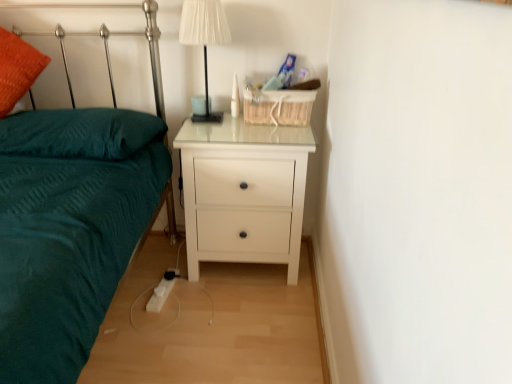
Question: Should I look upward or downward to see white glossy nightstand at center?

Choices:
 (A) up
 (B) down

Answer: (B)

Question: Considering the relative sizes of white fabric lampshade at upper center and teal soft pillow at left in the image provided, is white fabric lampshade at upper center bigger than teal soft pillow at left?

Choices:
 (A) yes
 (B) no

Answer: (B)

Question: Is the depth of white fabric lampshade at upper center greater than that of teal soft pillow at left?

Choices:
 (A) no
 (B) yes

Answer: (B)

Question: Does white fabric lampshade at upper center have a lesser width compared to teal soft pillow at left?

Choices:
 (A) yes
 (B) no

Answer: (A)

Question: Is white fabric lampshade at upper center not within teal soft pillow at left?

Choices:
 (A) yes
 (B) no

Answer: (A)

Question: Considering the relative sizes of white fabric lampshade at upper center and teal soft pillow at left in the image provided, is white fabric lampshade at upper center taller than teal soft pillow at left?

Choices:
 (A) no
 (B) yes

Answer: (B)

Question: Considering the relative positions of white fabric lampshade at upper center and teal soft pillow at left in the image provided, is white fabric lampshade at upper center to the left of teal soft pillow at left from the viewer's perspective?

Choices:
 (A) yes
 (B) no

Answer: (B)

Question: Is white glossy nightstand at center shorter than teal soft pillow at left?

Choices:
 (A) yes
 (B) no

Answer: (B)

Question: Could you tell me if white glossy nightstand at center is facing teal soft pillow at left?

Choices:
 (A) yes
 (B) no

Answer: (B)

Question: Is white glossy nightstand at center directly adjacent to teal soft pillow at left?

Choices:
 (A) no
 (B) yes

Answer: (A)

Question: Is white glossy nightstand at center oriented away from teal soft pillow at left?

Choices:
 (A) no
 (B) yes

Answer: (A)

Question: From a real-world perspective, is white glossy nightstand at center over teal soft pillow at left?

Choices:
 (A) no
 (B) yes

Answer: (A)

Question: Does white glossy nightstand at center appear on the right side of teal soft pillow at left?

Choices:
 (A) no
 (B) yes

Answer: (B)

Question: Does white glossy nightstand at center have a greater height compared to white fabric lampshade at upper center?

Choices:
 (A) no
 (B) yes

Answer: (B)